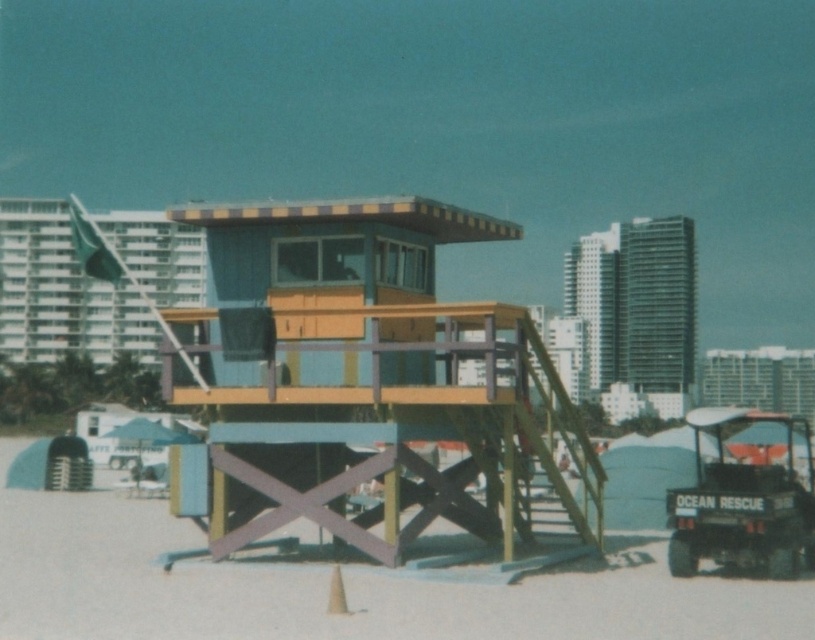
Which is more to the right, wooden lifeguard tower at center or white sand at center?

From the viewer's perspective, wooden lifeguard tower at center appears more on the right side.

This screenshot has height=640, width=815. I want to click on wooden lifeguard tower at center, so click(x=366, y=381).